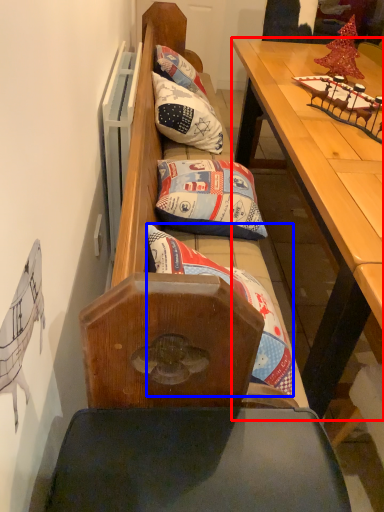
Question: Among these objects, which one is nearest to the camera, table (highlighted by a red box) or pillow (highlighted by a blue box)?

Choices:
 (A) table
 (B) pillow

Answer: (A)